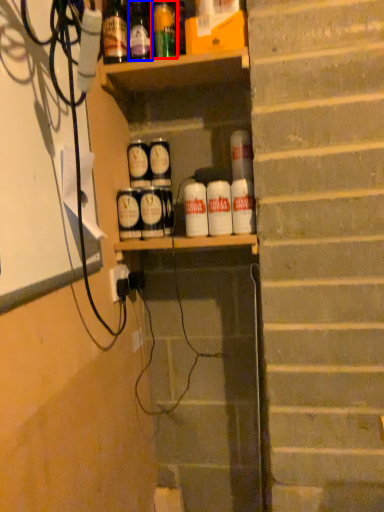
Question: Which of the following is the closest to the observer, bottle (highlighted by a red box) or bottle (highlighted by a blue box)?

Choices:
 (A) bottle
 (B) bottle

Answer: (B)